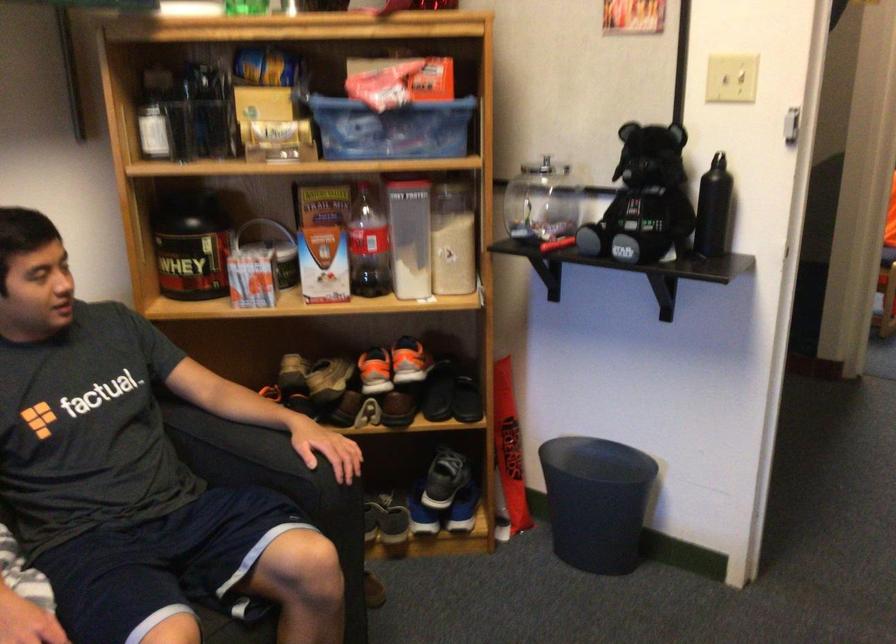
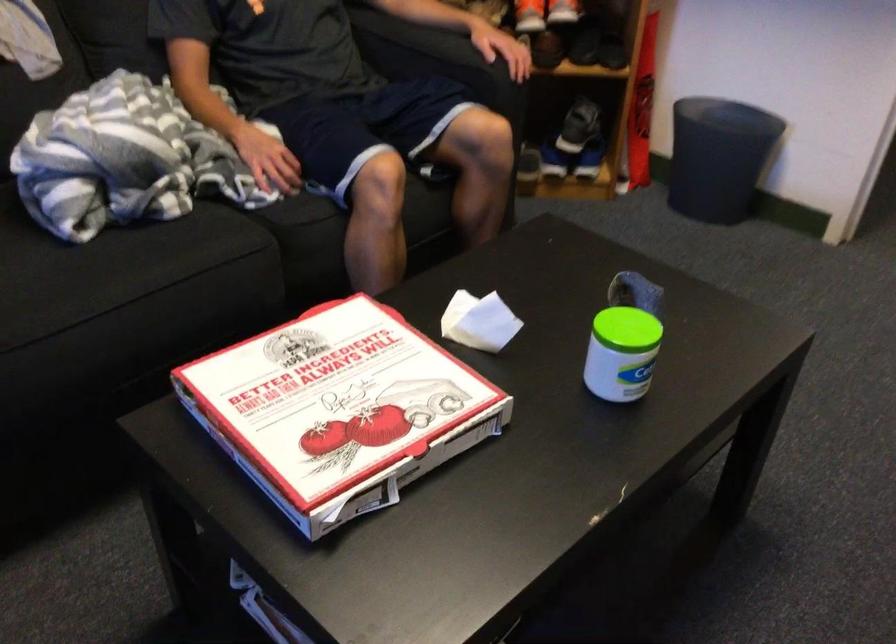
Which direction would the cameraman need to move to produce the second image?

The cameraman moved toward left, backward.